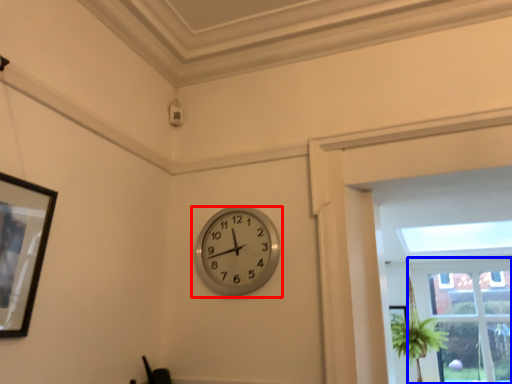
Question: Which point is closer to the camera, wall clock (highlighted by a red box) or window (highlighted by a blue box)?

Choices:
 (A) wall clock
 (B) window

Answer: (A)